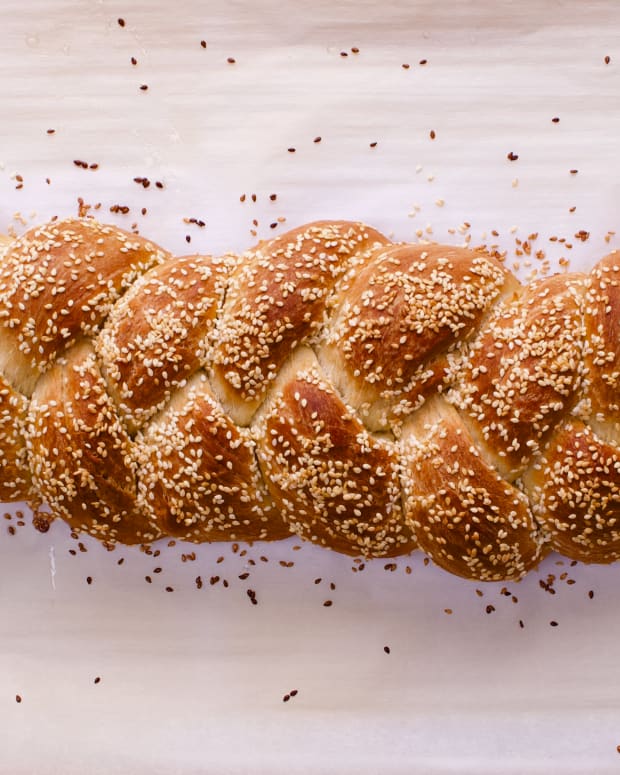
Identify the location of cutting board. (490, 43).